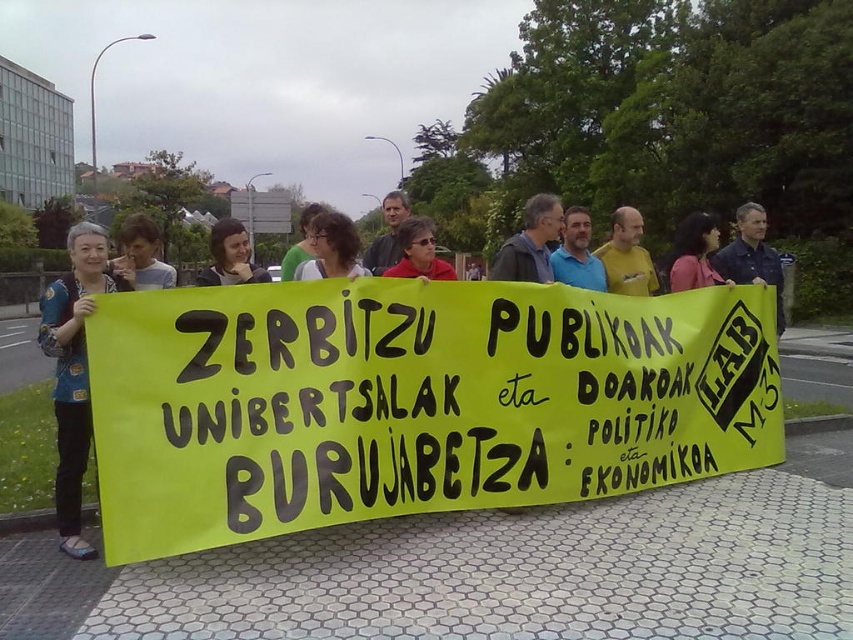
Question: Can you confirm if yellow paper banner at center is positioned below yellow matte shirt at center?

Choices:
 (A) no
 (B) yes

Answer: (B)

Question: Which object is positioned farthest from the pink fabric shirt at center?

Choices:
 (A) dark gray shirt at center
 (B) blue fabric shirt at left

Answer: (A)

Question: Is pink fabric shirt at center closer to camera compared to matte black jacket at center?

Choices:
 (A) no
 (B) yes

Answer: (A)

Question: Which object is positioned closest to the green matte shirt at center?

Choices:
 (A) dark gray shirt at center
 (B) matte black jacket at center
 (C) blue denim shirt at center

Answer: (A)

Question: Which object is farther from the camera taking this photo?

Choices:
 (A) matte black jacket at center
 (B) matte black glasses at center

Answer: (A)

Question: Is pink fabric shirt at center smaller than green matte shirt at center?

Choices:
 (A) yes
 (B) no

Answer: (A)